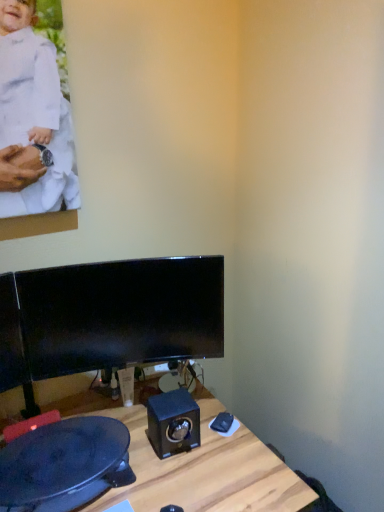
The image size is (384, 512). In order to click on vacant area located to the right-hand side of black glossy speaker at center in this screenshot , I will do `click(226, 452)`.